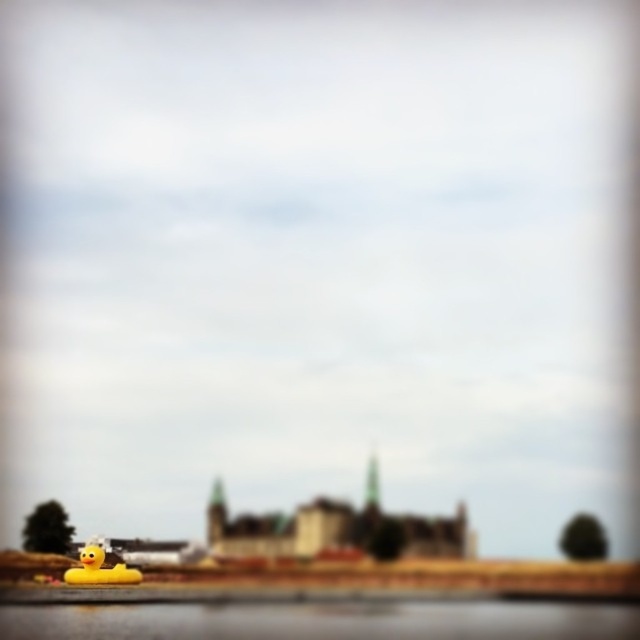
You are a photographer trying to capture the yellow rubber duck at lower left and the transparent plastic water at lower left in a single shot. Since the image is slightly out of focus, you need to adjust your camera to focus on the closer object. Which object should you focus on to ensure it appears sharp?

The transparent plastic water at lower left is closer to the viewer than the yellow rubber duck at lower left, so you should focus on the transparent plastic water at lower left to ensure it appears sharp.

You are standing at the edge of the scene and want to place a small toy boat in the transparent plastic water at lower left without it touching the yellow rubber duck at lower left. Is there enough space?

The transparent plastic water at lower left has a larger size compared to yellow rubber duck at lower left, so yes, there is enough space to place the small toy boat in the transparent plastic water at lower left without it touching the yellow rubber duck at lower left.